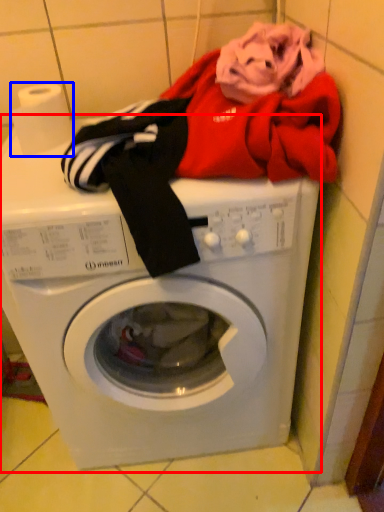
Question: Which object appears farthest to the camera in this image, washing machine (highlighted by a red box) or toilet paper (highlighted by a blue box)?

Choices:
 (A) washing machine
 (B) toilet paper

Answer: (B)